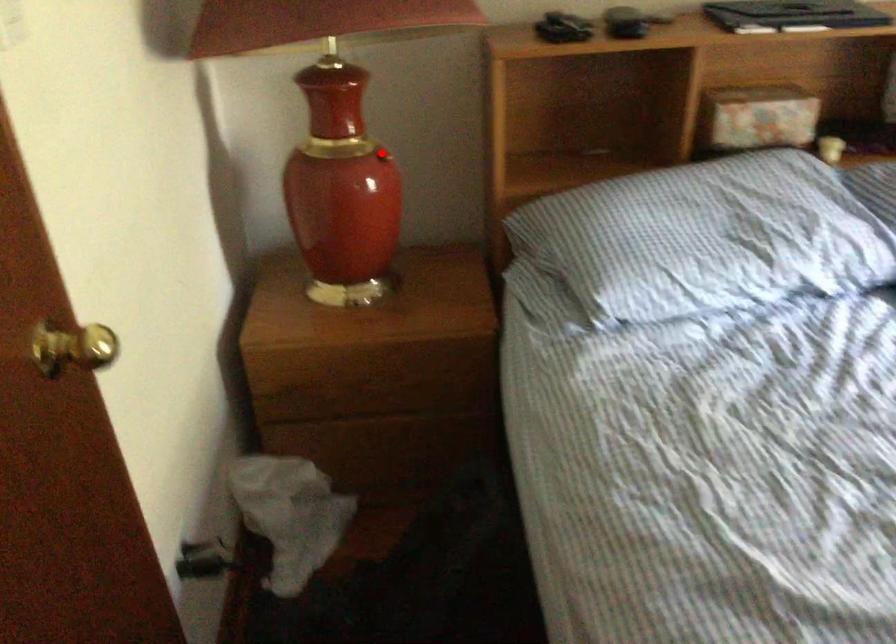
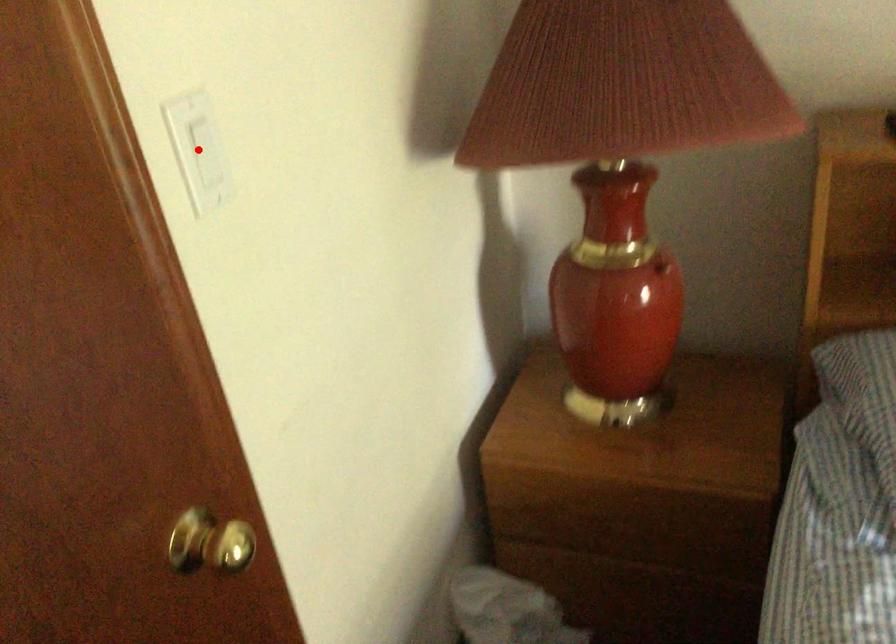
I am providing you with two images of the same scene from different viewpoints. A red point is marked on the first image and another point is marked on the second image. Do the highlighted points in image1 and image2 indicate the same real-world spot?

No